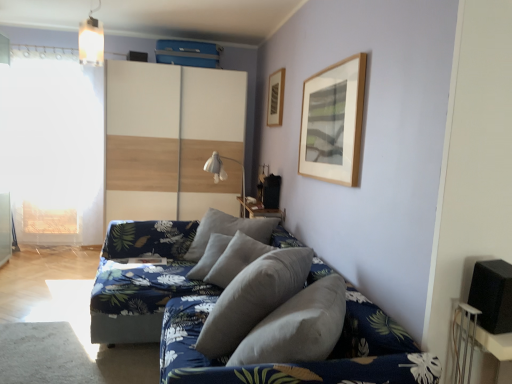
The image size is (512, 384). What are the coordinates of `gray fabric pillow at center, the second pillow viewed from the back` in the screenshot? It's located at (253, 298).

At what (x,y) coordinates should I click in order to perform the action: click on wooden table at center, the second table from the bottom. Please return your answer as a coordinate pair (x, y). Looking at the image, I should click on (260, 210).

What do you see at coordinates (492, 295) in the screenshot?
I see `black matte speaker at right` at bounding box center [492, 295].

In order to click on gray fabric pillow at center, arranged as the 2th pillow when viewed from the front in this screenshot , I will do click(228, 230).

Is white plastic table at lower right, the 1th table from the bottom, inside the boundaries of wooden table at center, which ranks as the first table in top-to-bottom order, or outside?

white plastic table at lower right, the 1th table from the bottom, is spatially situated outside wooden table at center, which ranks as the first table in top-to-bottom order.

Is there a large distance between white plastic table at lower right, which is the 2th table in left-to-right order, and wooden table at center, the 2th table viewed from the right?

Yes, white plastic table at lower right, which is the 2th table in left-to-right order, and wooden table at center, the 2th table viewed from the right, are located far from each other.

Which of these two, white plastic table at lower right, which ranks as the 2th table in top-to-bottom order, or wooden table at center, marked as the 2th table in a front-to-back arrangement, is thinner?

white plastic table at lower right, which ranks as the 2th table in top-to-bottom order, is thinner.

Who is bigger, white plastic table at lower right, which ranks as the 2th table in top-to-bottom order, or wooden table at center, acting as the first table starting from the back?

wooden table at center, acting as the first table starting from the back, is bigger.

From a real-world perspective, which object stands above the other?

white wood dresser at center is physically above.

From the image's perspective, is wooden table at center, the 2th table viewed from the right, under white wood dresser at center?

Correct, wooden table at center, the 2th table viewed from the right, appears lower than white wood dresser at center in the image.

Does wooden table at center, acting as the first table starting from the back, appear on the left side of white wood dresser at center?

No.

Looking at this image, can you confirm if gray fabric pillow at center, the second pillow viewed from the back, is taller than white wood dresser at center?

No.

From the image's perspective, between gray fabric pillow at center, the second pillow viewed from the back, and white wood dresser at center, which one is located above?

→ white wood dresser at center appears higher in the image.

Based on the photo, considering the sizes of objects gray fabric pillow at center, placed as the 1th pillow when sorted from front to back, and white wood dresser at center in the image provided, who is wider, gray fabric pillow at center, placed as the 1th pillow when sorted from front to back, or white wood dresser at center?

white wood dresser at center is wider.

From a real-world perspective, is gray fabric pillow at center, the second pillow viewed from the back, positioned under white wood dresser at center based on gravity?

Indeed, from a real-world perspective, gray fabric pillow at center, the second pillow viewed from the back, is positioned beneath white wood dresser at center.

Considering the sizes of objects white plastic table at lower right, marked as the 1th table in a front-to-back arrangement, and gray fabric pillow at center, the second pillow viewed from the back, in the image provided, who is bigger, white plastic table at lower right, marked as the 1th table in a front-to-back arrangement, or gray fabric pillow at center, the second pillow viewed from the back,?

gray fabric pillow at center, the second pillow viewed from the back, is bigger.

Could you measure the distance between white plastic table at lower right, which is the 2th table in left-to-right order, and gray fabric pillow at center, the second pillow viewed from the back?

They are 34.07 inches apart.

Does white plastic table at lower right, positioned as the 1th table in right-to-left order, come behind gray fabric pillow at center, the second pillow viewed from the back?

No, it is in front of gray fabric pillow at center, the second pillow viewed from the back.

Based on the photo, from a real-world perspective, is white plastic table at lower right, which is the 2th table in left-to-right order, under gray fabric pillow at center, placed as the 1th pillow when sorted from front to back?

Incorrect, from a real-world perspective, white plastic table at lower right, which is the 2th table in left-to-right order, is higher than gray fabric pillow at center, placed as the 1th pillow when sorted from front to back.

From a real-world perspective, is wooden picture frame at upper center physically located above or below white fabric lampshade at center?

From a real-world perspective, wooden picture frame at upper center is physically above white fabric lampshade at center.

Considering the points (282, 82) and (224, 158), which point is in front, point (282, 82) or point (224, 158)?

Positioned in front is point (282, 82).

Based on the photo, is wooden picture frame at upper center smaller than white fabric lampshade at center?

Correct, wooden picture frame at upper center occupies less space than white fabric lampshade at center.

Based on their sizes in the image, would you say white plastic table at lower right, which ranks as the 2th table in top-to-bottom order, is bigger or smaller than white matte window screen at left?

white plastic table at lower right, which ranks as the 2th table in top-to-bottom order, is smaller than white matte window screen at left.

Which is behind, point (455, 316) or point (73, 177)?

Point (73, 177)

In the image, is white plastic table at lower right, positioned as the 1th table in right-to-left order, on the left side or the right side of white matte window screen at left?

Based on their positions, white plastic table at lower right, positioned as the 1th table in right-to-left order, is located to the right of white matte window screen at left.

Can you see white plastic table at lower right, the 1th table from the bottom, touching white matte window screen at left?

No, white plastic table at lower right, the 1th table from the bottom, is not making contact with white matte window screen at left.

From a real-world perspective, is gray fabric pillow at center, placed as the 1th pillow when sorted from front to back, over white plastic table at lower right, the 1th table from the bottom?

No, from a real-world perspective, gray fabric pillow at center, placed as the 1th pillow when sorted from front to back, is not above white plastic table at lower right, the 1th table from the bottom.

Does gray fabric pillow at center, placed as the 1th pillow when sorted from front to back, appear on the left side of white plastic table at lower right, marked as the 1th table in a front-to-back arrangement?

Yes, gray fabric pillow at center, placed as the 1th pillow when sorted from front to back, is to the left of white plastic table at lower right, marked as the 1th table in a front-to-back arrangement.

Which of these two, gray fabric pillow at center, placed as the 1th pillow when sorted from front to back, or white plastic table at lower right, positioned as the 1th table in right-to-left order, is smaller?

white plastic table at lower right, positioned as the 1th table in right-to-left order.

In the scene shown: Are gray fabric pillow at center, the second pillow viewed from the back, and white plastic table at lower right, which ranks as the 2th table in top-to-bottom order, beside each other?

No.

Where is `table on the left of white plastic table at lower right, which is the 2th table in left-to-right order`? table on the left of white plastic table at lower right, which is the 2th table in left-to-right order is located at coordinates (260, 210).

Which table is the 1st one when counting from the front of the white wood dresser at center? Please provide its 2D coordinates.

[(260, 210)]

From the image, which object appears to be nearer to white fabric lampshade at center, gray fabric pillow at center, the second pillow viewed from the back, or wooden picture frame at upper center?

The object closer to white fabric lampshade at center is wooden picture frame at upper center.

Looking at the image, which one is located closer to black matte speaker at right, wooden table at center, acting as the first table starting from the back, or metallic pendant light at upper center?

Based on the image, wooden table at center, acting as the first table starting from the back, appears to be nearer to black matte speaker at right.

Considering their positions, is white matte window screen at left positioned further to gray fabric pillow at center, which is the first pillow from back to front, than metallic pendant light at upper center?

white matte window screen at left is further to gray fabric pillow at center, which is the first pillow from back to front.

When comparing their distances from gray fabric pillow at center, arranged as the 2th pillow when viewed from the front, does white plastic table at lower right, which ranks as the 2th table in top-to-bottom order, or white matte window screen at left seem further?

Among the two, white matte window screen at left is located further to gray fabric pillow at center, arranged as the 2th pillow when viewed from the front.

From the image, which object appears to be farther from metallic pendant light at upper center, gray fabric pillow at center, which is the first pillow from back to front, or white matte window screen at left?

Among the two, gray fabric pillow at center, which is the first pillow from back to front, is located further to metallic pendant light at upper center.

Considering their positions, is wooden table at center, which ranks as the first table in top-to-bottom order, positioned further to blue floral fabric couch at center than white plastic table at lower right, which ranks as the 2th table in top-to-bottom order?

wooden table at center, which ranks as the first table in top-to-bottom order, lies further to blue floral fabric couch at center than the other object.

From the picture: Estimate the real-world distances between objects in this image. Which object is further from black matte speaker at right, white matte window screen at left or gray fabric pillow at center, arranged as the 2th pillow when viewed from the front?

white matte window screen at left is positioned further to the anchor black matte speaker at right.

Which object lies further to the anchor point gray fabric pillow at center, placed as the 1th pillow when sorted from front to back, white wood dresser at center or blue floral fabric couch at center?

Among the two, white wood dresser at center is located further to gray fabric pillow at center, placed as the 1th pillow when sorted from front to back.

In order to click on speaker between blue floral fabric couch at center and white fabric lampshade at center along the z-axis in this screenshot , I will do `click(492, 295)`.

Locate an element on the screen. This screenshot has width=512, height=384. dresser between white matte window screen at left and white fabric lampshade at center in the horizontal direction is located at coordinates (170, 139).

You are a GUI agent. You are given a task and a screenshot of the screen. Output one action in this format:
    pyautogui.click(x=<x>, y=<y>)
    Task: Click on the table situated between metallic pendant light at upper center and wooden picture frame at upper center from left to right
    This screenshot has width=512, height=384.
    Given the screenshot: What is the action you would take?
    pyautogui.click(x=260, y=210)

What are the coordinates of `dresser between blue floral fabric couch at center and white matte window screen at left from front to back` in the screenshot? It's located at (170, 139).